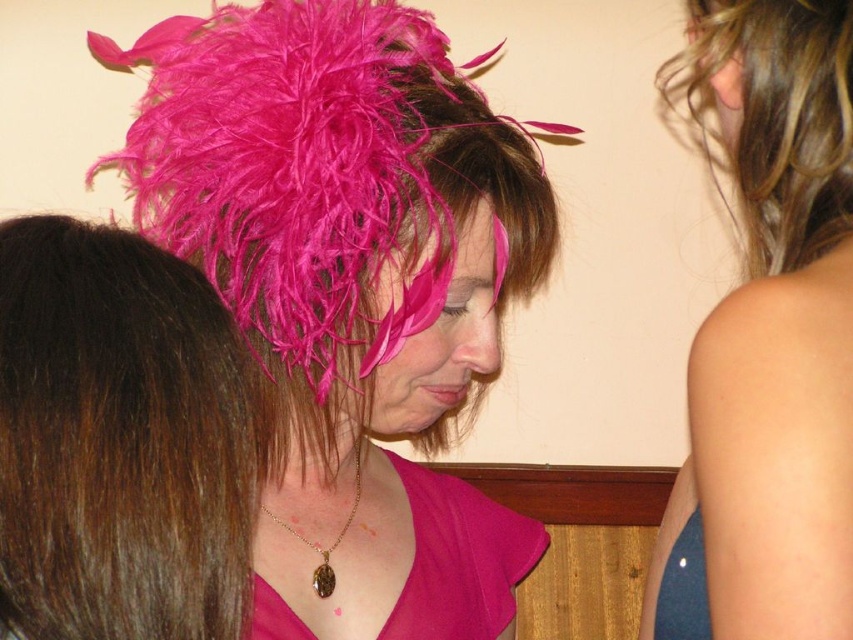
You are an artist trying to paint the scene. You need to place a fuzzy pink feather exactly at the center of your canvas. According to the image, is the fuzzy pink feather at point (323, 172) already positioned at the center?

Yes, the fuzzy pink feather at point (323, 172) is already positioned at the center as stated in the Objects Description.

You are a fashion designer preparing for a runway show. You have two dresses to display in the image, the smooth blue dress at right and the pink satin dress at center. Based on their positions, which dress should you feature first in the show to ensure the audience sees it clearly?

The smooth blue dress at right should be featured first because it is in front of the pink satin dress at center, making it more visible to the audience.